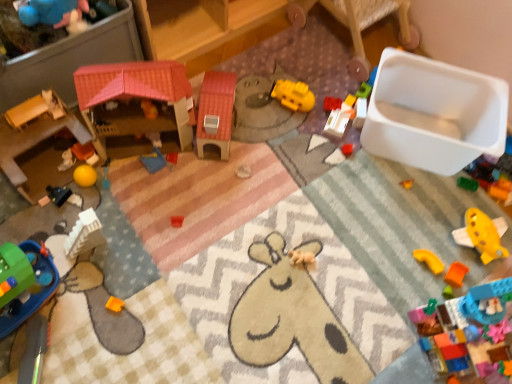
This screenshot has width=512, height=384. Find the location of `free spot in front of green plastic toy at lower left, acting as the second toy starting from the left`. free spot in front of green plastic toy at lower left, acting as the second toy starting from the left is located at coordinates (34, 357).